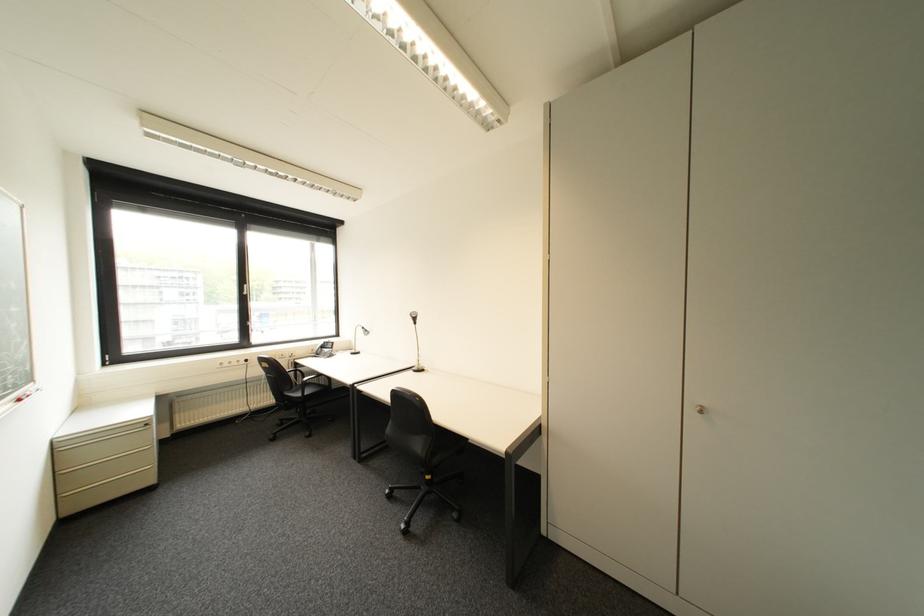
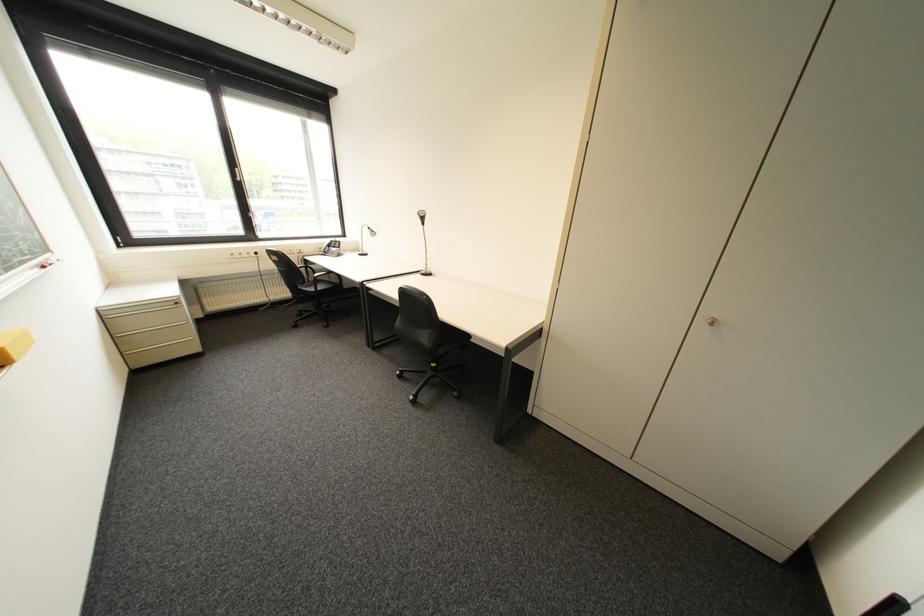
Question: Which direction would the cameraman need to move to produce the second image? Reply with the corresponding letter.

Choices:
 (A) Left
 (B) Right
 (C) Forward
 (D) Backward

Answer: (C)